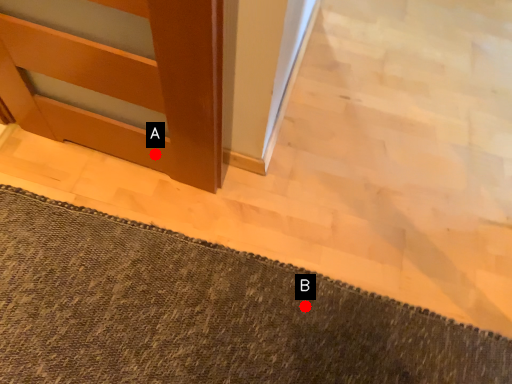
Question: Two points are circled on the image, labeled by A and B beside each circle. Which point is closer to the camera taking this photo?

Choices:
 (A) A is closer
 (B) B is closer

Answer: (B)